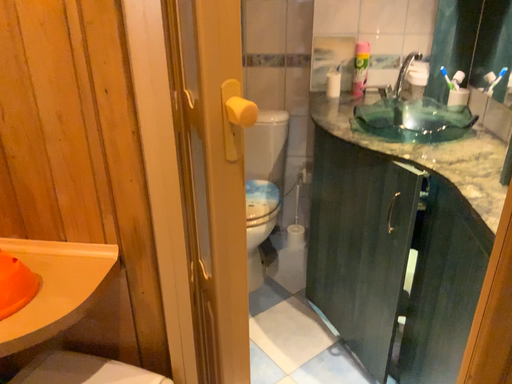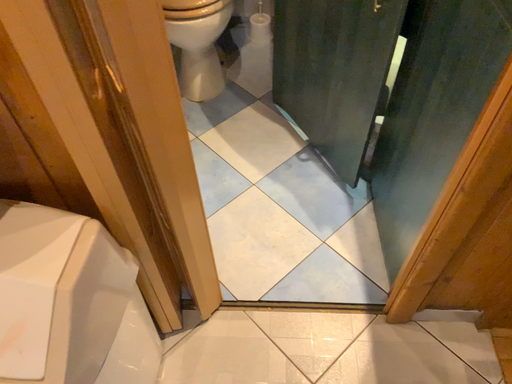
Question: Which way did the camera rotate in the video?

Choices:
 (A) rotated upward
 (B) rotated downward

Answer: (B)